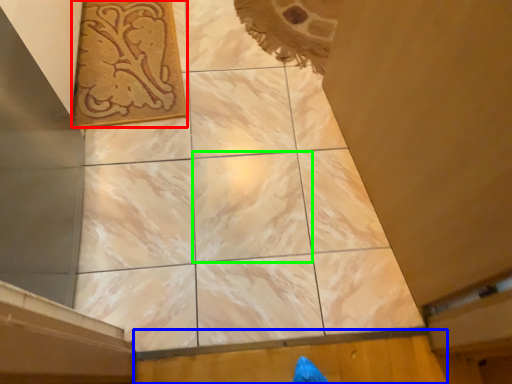
Question: Which is nearer to the design (highlighted by a red box)? plywood (highlighted by a blue box) or tile (highlighted by a green box).

Choices:
 (A) plywood
 (B) tile

Answer: (B)